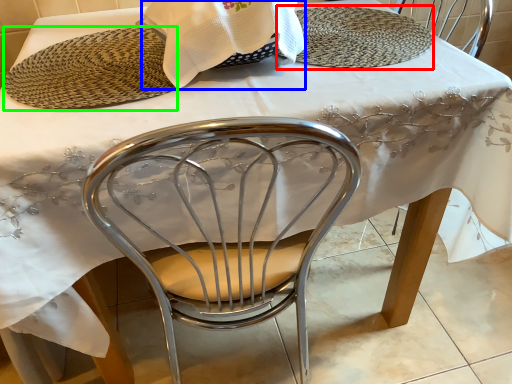
Question: Which is farther away from plate (highlighted by a red box)? blanket (highlighted by a blue box) or platter (highlighted by a green box)?

Choices:
 (A) blanket
 (B) platter

Answer: (B)